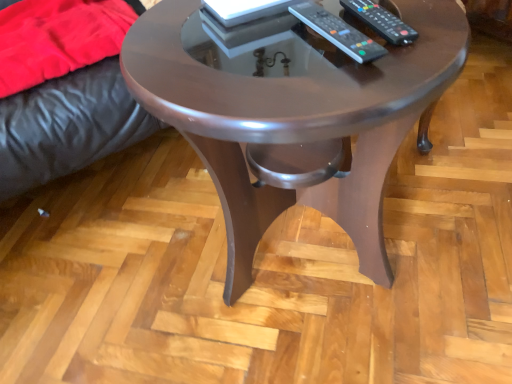
Locate an element on the screen. Image resolution: width=512 pixels, height=384 pixels. black plastic remote at upper right, marked as the 1th remote in a right-to-left arrangement is located at coordinates (381, 21).

How many degrees apart are the facing directions of shiny brown wood coffee table at center and velvet red blanket at left?

They differ by 0.436 degrees in their facing directions.

Is shiny brown wood coffee table at center shorter than velvet red blanket at left?

No, shiny brown wood coffee table at center is not shorter than velvet red blanket at left.

Which is in front, shiny brown wood coffee table at center or velvet red blanket at left?

shiny brown wood coffee table at center is in front.

Would you say velvet red blanket at left is part of shiny brown wood coffee table at center's contents?

No, velvet red blanket at left is not inside shiny brown wood coffee table at center.

How different are the orientations of black plastic remote at center, the first remote in the left-to-right sequence, and shiny brown wood coffee table at center in degrees?

The angular difference between black plastic remote at center, the first remote in the left-to-right sequence, and shiny brown wood coffee table at center is 11.3 degrees.

Can you confirm if black plastic remote at center, the first remote in the left-to-right sequence, is bigger than shiny brown wood coffee table at center?

No.

Between black plastic remote at center, the first remote in the left-to-right sequence, and shiny brown wood coffee table at center, which one appears on the right side from the viewer's perspective?

black plastic remote at center, the first remote in the left-to-right sequence.

From a real-world perspective, who is located higher, black plastic remote at center, the first remote in the left-to-right sequence, or shiny brown wood coffee table at center?

black plastic remote at center, the first remote in the left-to-right sequence, is physically above.

Considering the relative positions of velvet red blanket at left and shiny brown wood coffee table at center in the image provided, is velvet red blanket at left to the left or to the right of shiny brown wood coffee table at center?

In the image, velvet red blanket at left appears on the left side of shiny brown wood coffee table at center.

Between velvet red blanket at left and shiny brown wood coffee table at center, which one has smaller size?

Smaller between the two is velvet red blanket at left.

Is velvet red blanket at left turned away from shiny brown wood coffee table at center?

No, velvet red blanket at left's orientation is not away from shiny brown wood coffee table at center.

Measure the distance between velvet red blanket at left and shiny brown wood coffee table at center.

They are 20.42 inches apart.

Which is further, (347, 73) or (370, 5)?

The point (370, 5) is farther.

Would you say shiny brown wood coffee table at center contains black plastic remote at upper right, positioned as the second remote in left-to-right order?

Yes.

Considering the relative sizes of shiny brown wood coffee table at center and black plastic remote at upper right, marked as the 1th remote in a right-to-left arrangement, in the image provided, is shiny brown wood coffee table at center smaller than black plastic remote at upper right, marked as the 1th remote in a right-to-left arrangement,?

Actually, shiny brown wood coffee table at center might be larger than black plastic remote at upper right, marked as the 1th remote in a right-to-left arrangement.

In the scene shown: From the image's perspective, would you say shiny brown wood coffee table at center is positioned over black plastic remote at upper right, positioned as the second remote in left-to-right order?

No, from the image's perspective, shiny brown wood coffee table at center is not on top of black plastic remote at upper right, positioned as the second remote in left-to-right order.

Does shiny brown wood coffee table at center appear on the left side of black plastic remote at center, which is the 2th remote from right to left?

Indeed, shiny brown wood coffee table at center is positioned on the left side of black plastic remote at center, which is the 2th remote from right to left.

From the image's perspective, is shiny brown wood coffee table at center above or below black plastic remote at center, which is the 2th remote from right to left?

shiny brown wood coffee table at center is situated lower than black plastic remote at center, which is the 2th remote from right to left, in the image.

Which point is more forward, (x=172, y=80) or (x=313, y=18)?

Positioned in front is point (x=172, y=80).

Is shiny brown wood coffee table at center outside of black plastic remote at center, the first remote in the left-to-right sequence?

shiny brown wood coffee table at center lies outside black plastic remote at center, the first remote in the left-to-right sequence,'s area.

Consider the image. Measure the distance from black plastic remote at upper right, positioned as the second remote in left-to-right order, to black plastic remote at center, which is the 2th remote from right to left.

A distance of 11.13 centimeters exists between black plastic remote at upper right, positioned as the second remote in left-to-right order, and black plastic remote at center, which is the 2th remote from right to left.

Is black plastic remote at upper right, positioned as the second remote in left-to-right order, further to camera compared to black plastic remote at center, which is the 2th remote from right to left?

Yes, it is behind black plastic remote at center, which is the 2th remote from right to left.

From a real-world perspective, which object rests below the other?

In real-world perspective, black plastic remote at center, the first remote in the left-to-right sequence, is lower.

Can you confirm if black plastic remote at upper right, positioned as the second remote in left-to-right order, is taller than black plastic remote at center, the first remote in the left-to-right sequence?

No.

Would you say velvet red blanket at left is inside or outside black plastic remote at center, which is the 2th remote from right to left?

velvet red blanket at left is outside black plastic remote at center, which is the 2th remote from right to left.

Does point (13, 7) appear closer or farther from the camera than point (304, 13)?

Point (13, 7) is positioned farther from the camera compared to point (304, 13).

Is the surface of velvet red blanket at left in direct contact with black plastic remote at center, the first remote in the left-to-right sequence?

velvet red blanket at left is not next to black plastic remote at center, the first remote in the left-to-right sequence, and they're not touching.

Is black plastic remote at center, which is the 2th remote from right to left, at the back of velvet red blanket at left?

No, velvet red blanket at left is not facing the opposite direction of black plastic remote at center, which is the 2th remote from right to left.

Locate an element on the screen. blanket behind the shiny brown wood coffee table at center is located at coordinates (57, 38).

You are a GUI agent. You are given a task and a screenshot of the screen. Output one action in this format:
    pyautogui.click(x=<x>, y=<y>)
    Task: Click on the 1st remote above the shiny brown wood coffee table at center (from a real-world perspective)
    Image resolution: width=512 pixels, height=384 pixels.
    Given the screenshot: What is the action you would take?
    pyautogui.click(x=338, y=32)

Estimate the real-world distances between objects in this image. Which object is further from black plastic remote at center, the first remote in the left-to-right sequence, black plastic remote at upper right, positioned as the second remote in left-to-right order, or velvet red blanket at left?

The object further to black plastic remote at center, the first remote in the left-to-right sequence, is velvet red blanket at left.

From the image, which object appears to be farther from black plastic remote at upper right, positioned as the second remote in left-to-right order, velvet red blanket at left or black plastic remote at center, which is the 2th remote from right to left?

velvet red blanket at left is positioned further to the anchor black plastic remote at upper right, positioned as the second remote in left-to-right order.

Which object lies nearer to the anchor point black plastic remote at center, the first remote in the left-to-right sequence, velvet red blanket at left or black plastic remote at upper right, marked as the 1th remote in a right-to-left arrangement?

black plastic remote at upper right, marked as the 1th remote in a right-to-left arrangement, is closer to black plastic remote at center, the first remote in the left-to-right sequence.

Which object lies nearer to the anchor point shiny brown wood coffee table at center, black plastic remote at center, the first remote in the left-to-right sequence, or black plastic remote at upper right, positioned as the second remote in left-to-right order?

The object closer to shiny brown wood coffee table at center is black plastic remote at center, the first remote in the left-to-right sequence.

Looking at the image, which one is located further to black plastic remote at center, the first remote in the left-to-right sequence, velvet red blanket at left or shiny brown wood coffee table at center?

velvet red blanket at left lies further to black plastic remote at center, the first remote in the left-to-right sequence, than the other object.

Looking at the image, which one is located closer to shiny brown wood coffee table at center, velvet red blanket at left or black plastic remote at upper right, positioned as the second remote in left-to-right order?

The object closer to shiny brown wood coffee table at center is black plastic remote at upper right, positioned as the second remote in left-to-right order.

Considering their positions, is velvet red blanket at left positioned further to black plastic remote at upper right, marked as the 1th remote in a right-to-left arrangement, than shiny brown wood coffee table at center?

velvet red blanket at left.

Looking at the image, which one is located further to black plastic remote at center, the first remote in the left-to-right sequence, shiny brown wood coffee table at center or velvet red blanket at left?

velvet red blanket at left is further to black plastic remote at center, the first remote in the left-to-right sequence.

You are a GUI agent. You are given a task and a screenshot of the screen. Output one action in this format:
    pyautogui.click(x=<x>, y=<y>)
    Task: Click on the remote between black plastic remote at upper right, positioned as the second remote in left-to-right order, and shiny brown wood coffee table at center from top to bottom
    Image resolution: width=512 pixels, height=384 pixels.
    Given the screenshot: What is the action you would take?
    pyautogui.click(x=338, y=32)

Image resolution: width=512 pixels, height=384 pixels. In order to click on remote located between velvet red blanket at left and black plastic remote at upper right, marked as the 1th remote in a right-to-left arrangement, in the left-right direction in this screenshot , I will do `click(338, 32)`.

Image resolution: width=512 pixels, height=384 pixels. I want to click on coffee table situated between velvet red blanket at left and black plastic remote at upper right, positioned as the second remote in left-to-right order, from left to right, so click(x=292, y=112).

You are a GUI agent. You are given a task and a screenshot of the screen. Output one action in this format:
    pyautogui.click(x=<x>, y=<y>)
    Task: Click on the coffee table between velvet red blanket at left and black plastic remote at center, which is the 2th remote from right to left
    The height and width of the screenshot is (384, 512).
    Given the screenshot: What is the action you would take?
    pyautogui.click(x=292, y=112)